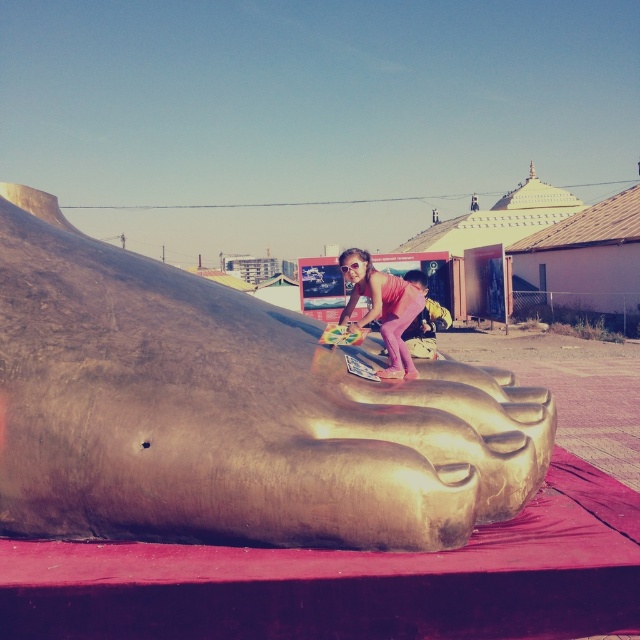
You are standing in front of the metallic sculpture and want to walk towards the white yurt in the background. Which point, point (275, 433) or point (403, 346), will you pass first?

Point (275, 433) is in front of point (403, 346), so you will pass point (275, 433) first on your way to the white yurt.

You are an artist planning to paint the scene. You need to decide which object, the gold metallic foot at center or the pink matte pants at center, requires more attention to detail due to its height. Which one should you focus on more?

The gold metallic foot at center is much taller than the pink matte pants at center, so you should focus more on painting the gold metallic foot at center to accurately capture its height and proportions.

You are an interior designer assessing the placement of the gold metallic foot at center and the pink matte pants at center in the room. Which object takes up more space visually?

The gold metallic foot at center has a larger size compared to the pink matte pants at center, so it takes up more visual space.